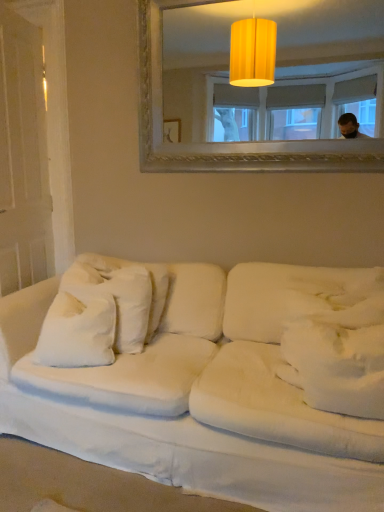
What is the approximate width of white fabric couch at lower center?

The width of white fabric couch at lower center is 38.34 inches.

What do you see at coordinates (336, 366) in the screenshot? The width and height of the screenshot is (384, 512). I see `white soft pillow at center, the 2th pillow when ordered from back to front` at bounding box center [336, 366].

Where is `white soft pillow at center, acting as the 1th pillow starting from the right`? Image resolution: width=384 pixels, height=512 pixels. white soft pillow at center, acting as the 1th pillow starting from the right is located at coordinates (336, 366).

The image size is (384, 512). Find the location of `white soft pillow at left, placed as the 2th pillow when sorted from front to back`. white soft pillow at left, placed as the 2th pillow when sorted from front to back is located at coordinates (114, 296).

Can you confirm if white soft pillow at center, acting as the 1th pillow starting from the right, is bigger than matte gold mirror at upper center?

No, white soft pillow at center, acting as the 1th pillow starting from the right, is not bigger than matte gold mirror at upper center.

Who is more distant, white soft pillow at center, the 1th pillow positioned from the front, or matte gold mirror at upper center?

matte gold mirror at upper center is more distant.

Is point (318, 384) positioned after point (181, 47)?

No, (318, 384) is closer to viewer.

Considering the sizes of objects white soft pillow at center, which is the second pillow in left-to-right order, and matte gold mirror at upper center in the image provided, who is shorter, white soft pillow at center, which is the second pillow in left-to-right order, or matte gold mirror at upper center?

Standing shorter between the two is white soft pillow at center, which is the second pillow in left-to-right order.

Locate an element on the screen. pillow that appears in front of the white soft pillow at left, acting as the 2th pillow starting from the right is located at coordinates (336, 366).

Is white soft pillow at left, acting as the 2th pillow starting from the right, aimed at white soft pillow at center, which is the second pillow in left-to-right order?

No, white soft pillow at left, acting as the 2th pillow starting from the right, does not turn towards white soft pillow at center, which is the second pillow in left-to-right order.

Considering the sizes of white soft pillow at left, placed as the 2th pillow when sorted from front to back, and white soft pillow at center, the 2th pillow when ordered from back to front, in the image, is white soft pillow at left, placed as the 2th pillow when sorted from front to back, wider or thinner than white soft pillow at center, the 2th pillow when ordered from back to front,?

In the image, white soft pillow at left, placed as the 2th pillow when sorted from front to back, appears to be wider than white soft pillow at center, the 2th pillow when ordered from back to front.

Who is more distant, white soft pillow at left, acting as the 2th pillow starting from the right, or white soft pillow at center, which is the second pillow in left-to-right order?

white soft pillow at left, acting as the 2th pillow starting from the right, is more distant.

From the image's perspective, which is below, white soft pillow at center, the 2th pillow when ordered from back to front, or white soft pillow at left, placed as the 2th pillow when sorted from front to back?

white soft pillow at center, the 2th pillow when ordered from back to front, appears lower in the image.

Considering the sizes of white soft pillow at center, acting as the 1th pillow starting from the right, and white soft pillow at left, acting as the 1th pillow starting from the left, in the image, is white soft pillow at center, acting as the 1th pillow starting from the right, taller or shorter than white soft pillow at left, acting as the 1th pillow starting from the left,?

In the image, white soft pillow at center, acting as the 1th pillow starting from the right, appears to be shorter than white soft pillow at left, acting as the 1th pillow starting from the left.

Does point (324, 409) lie behind point (89, 300)?

No, (324, 409) is closer to viewer.

Consider the image. Can you confirm if white soft pillow at center, the 1th pillow positioned from the front, is positioned to the right of white soft pillow at left, which is the 1th pillow from back to front?

Indeed, white soft pillow at center, the 1th pillow positioned from the front, is positioned on the right side of white soft pillow at left, which is the 1th pillow from back to front.

From the image's perspective, who appears lower, white fabric couch at lower center or white soft pillow at left, acting as the 1th pillow starting from the left?

white fabric couch at lower center is shown below in the image.

Is white fabric couch at lower center thinner than white soft pillow at left, which is the 1th pillow from back to front?

In fact, white fabric couch at lower center might be wider than white soft pillow at left, which is the 1th pillow from back to front.

Is white fabric couch at lower center to the left or to the right of white soft pillow at left, which is the 1th pillow from back to front, in the image?

Based on their positions, white fabric couch at lower center is located to the right of white soft pillow at left, which is the 1th pillow from back to front.

Who is smaller, white fabric couch at lower center or white soft pillow at left, which is the 1th pillow from back to front?

With smaller size is white soft pillow at left, which is the 1th pillow from back to front.

Is white soft pillow at center, acting as the 1th pillow starting from the right, next to white fabric couch at lower center and touching it?

No, white soft pillow at center, acting as the 1th pillow starting from the right, is not making contact with white fabric couch at lower center.

Could white fabric couch at lower center be considered to be inside white soft pillow at center, which is the second pillow in left-to-right order?

No, white soft pillow at center, which is the second pillow in left-to-right order, does not contain white fabric couch at lower center.

Is white soft pillow at center, acting as the 1th pillow starting from the right, wider or thinner than white fabric couch at lower center?

white soft pillow at center, acting as the 1th pillow starting from the right, is thinner than white fabric couch at lower center.

Locate an element on the screen. The width and height of the screenshot is (384, 512). the 1st pillow behind the white fabric couch at lower center, counting from the anchor's position is located at coordinates (336, 366).

Can you confirm if white fabric couch at lower center is bigger than white soft pillow at center, which is the second pillow in left-to-right order?

A: Indeed, white fabric couch at lower center has a larger size compared to white soft pillow at center, which is the second pillow in left-to-right order.

Which object is thinner, white fabric couch at lower center or white soft pillow at center, acting as the 1th pillow starting from the right?

white soft pillow at center, acting as the 1th pillow starting from the right.

Is white fabric couch at lower center taller than white soft pillow at center, which is the second pillow in left-to-right order?

Yes.

Would you consider white fabric couch at lower center to be distant from white soft pillow at center, the 2th pillow when ordered from back to front?

No, white fabric couch at lower center is in close proximity to white soft pillow at center, the 2th pillow when ordered from back to front.

Which is in front, white soft pillow at left, acting as the 1th pillow starting from the left, or matte gold mirror at upper center?

matte gold mirror at upper center is more forward.

From a real-world perspective, is white soft pillow at left, placed as the 2th pillow when sorted from front to back, below matte gold mirror at upper center?

Yes, from a real-world perspective, white soft pillow at left, placed as the 2th pillow when sorted from front to back, is below matte gold mirror at upper center.

Find the location of a particular element. This screenshot has width=384, height=512. mirror that is on the right side of white soft pillow at left, which is the 1th pillow from back to front is located at coordinates (275, 70).

Can you confirm if white soft pillow at left, which is the 1th pillow from back to front, is thinner than matte gold mirror at upper center?

In fact, white soft pillow at left, which is the 1th pillow from back to front, might be wider than matte gold mirror at upper center.

There is a matte gold mirror at upper center. Where is `the 2nd pillow below it (from a real-world perspective)`? This screenshot has width=384, height=512. the 2nd pillow below it (from a real-world perspective) is located at coordinates (336, 366).

Where is `pillow above the white soft pillow at center, acting as the 1th pillow starting from the right (from a real-world perspective)`? Image resolution: width=384 pixels, height=512 pixels. pillow above the white soft pillow at center, acting as the 1th pillow starting from the right (from a real-world perspective) is located at coordinates (114, 296).

Based on their spatial positions, is white soft pillow at left, which is the 1th pillow from back to front, or white fabric couch at lower center further from matte gold mirror at upper center?

white fabric couch at lower center is positioned further to the anchor matte gold mirror at upper center.

When comparing their distances from matte gold mirror at upper center, does white soft pillow at center, acting as the 1th pillow starting from the right, or white fabric couch at lower center seem closer?

white fabric couch at lower center.

When comparing their distances from white soft pillow at left, acting as the 2th pillow starting from the right, does matte gold mirror at upper center or white fabric couch at lower center seem closer?

Among the two, white fabric couch at lower center is located nearer to white soft pillow at left, acting as the 2th pillow starting from the right.

Which object lies further to the anchor point white fabric couch at lower center, matte gold mirror at upper center or white soft pillow at left, placed as the 2th pillow when sorted from front to back?

The object further to white fabric couch at lower center is matte gold mirror at upper center.

Consider the image. Looking at the image, which one is located further to white soft pillow at left, acting as the 1th pillow starting from the left, matte gold mirror at upper center or white soft pillow at center, the 2th pillow when ordered from back to front?

The object further to white soft pillow at left, acting as the 1th pillow starting from the left, is matte gold mirror at upper center.

Which object lies nearer to the anchor point white soft pillow at left, placed as the 2th pillow when sorted from front to back, white fabric couch at lower center or white soft pillow at center, acting as the 1th pillow starting from the right?

Among the two, white fabric couch at lower center is located nearer to white soft pillow at left, placed as the 2th pillow when sorted from front to back.

Considering their positions, is white soft pillow at left, acting as the 2th pillow starting from the right, positioned further to matte gold mirror at upper center than white soft pillow at center, the 2th pillow when ordered from back to front?

white soft pillow at center, the 2th pillow when ordered from back to front.

When comparing their distances from white fabric couch at lower center, does matte gold mirror at upper center or white soft pillow at center, the 2th pillow when ordered from back to front, seem closer?

The object closer to white fabric couch at lower center is white soft pillow at center, the 2th pillow when ordered from back to front.

Where is `pillow between matte gold mirror at upper center and white soft pillow at center, which is the second pillow in left-to-right order, from top to bottom`? The width and height of the screenshot is (384, 512). pillow between matte gold mirror at upper center and white soft pillow at center, which is the second pillow in left-to-right order, from top to bottom is located at coordinates (114, 296).

Locate an element on the screen. pillow between white fabric couch at lower center and white soft pillow at left, acting as the 2th pillow starting from the right, along the z-axis is located at coordinates (336, 366).